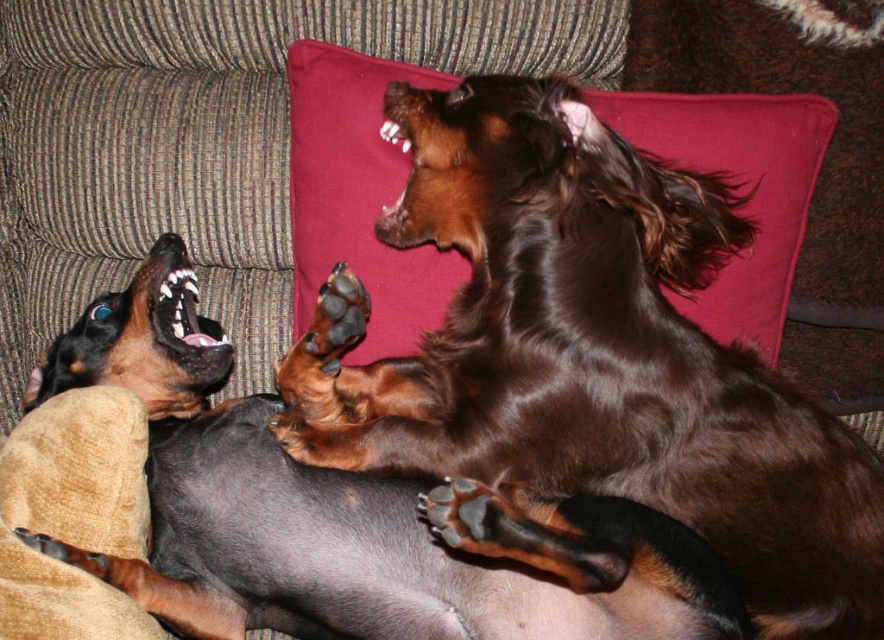
Question: Is black glossy dog at center further to camera compared to velvet cushion at upper center?

Choices:
 (A) yes
 (B) no

Answer: (B)

Question: Does shiny brown fur at upper center appear under brown furry dog at upper right?

Choices:
 (A) yes
 (B) no

Answer: (A)

Question: Which of these objects is positioned farthest from the shiny brown fur at upper center?

Choices:
 (A) brown furry dog at upper right
 (B) velvet cushion at upper center
 (C) black glossy dog at center

Answer: (A)

Question: In this image, where is black glossy dog at center located relative to brown furry dog at upper right?

Choices:
 (A) below
 (B) above

Answer: (A)

Question: Among these objects, which one is nearest to the camera?

Choices:
 (A) black glossy dog at center
 (B) brown furry dog at upper right
 (C) velvet cushion at upper center

Answer: (A)

Question: Which object is closer to the camera taking this photo?

Choices:
 (A) velvet cushion at upper center
 (B) brown furry dog at upper right

Answer: (A)